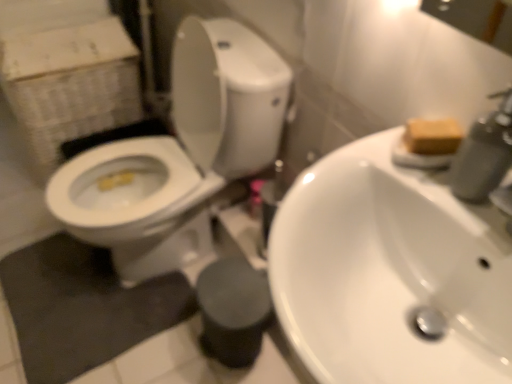
Image resolution: width=512 pixels, height=384 pixels. What do you see at coordinates (82, 307) in the screenshot?
I see `black rubber bath mat at lower left` at bounding box center [82, 307].

Locate an element on the screen. The height and width of the screenshot is (384, 512). brown matte soap at upper right is located at coordinates (433, 136).

Where is `matte gray soap dispenser at upper right`? Image resolution: width=512 pixels, height=384 pixels. matte gray soap dispenser at upper right is located at coordinates (484, 153).

What do you see at coordinates (484, 153) in the screenshot? The width and height of the screenshot is (512, 384). I see `matte gray soap dispenser at upper right` at bounding box center [484, 153].

The height and width of the screenshot is (384, 512). What do you see at coordinates (67, 71) in the screenshot?
I see `white cardboard box at left` at bounding box center [67, 71].

At what (x,y) coordinates should I click in order to perform the action: click on white glossy sink at center. Please return your answer as a coordinate pair (x, y). Looking at the image, I should click on (390, 272).

Is brown matte soap at upper right oriented away from white cardboard box at left?

No, brown matte soap at upper right is not facing the opposite direction of white cardboard box at left.

Is brown matte soap at upper right positioned far away from white cardboard box at left?

brown matte soap at upper right is far away from white cardboard box at left.

From the picture: From the image's perspective, is brown matte soap at upper right beneath white cardboard box at left?

Correct, brown matte soap at upper right appears lower than white cardboard box at left in the image.

I want to click on cardboard box located behind the brown matte soap at upper right, so click(x=67, y=71).

Consider the image. Who is shorter, white glossy toilet at left or matte gray soap dispenser at upper right?

matte gray soap dispenser at upper right is shorter.

Who is bigger, white glossy toilet at left or matte gray soap dispenser at upper right?

white glossy toilet at left is bigger.

Would you say white glossy toilet at left is a long distance from matte gray soap dispenser at upper right?

No, white glossy toilet at left is not far from matte gray soap dispenser at upper right.

From the image's perspective, which object appears higher, matte gray soap dispenser at upper right or black rubber bath mat at lower left?

matte gray soap dispenser at upper right, from the image's perspective.

Can black rubber bath mat at lower left be found inside matte gray soap dispenser at upper right?

No, black rubber bath mat at lower left is not a part of matte gray soap dispenser at upper right.

Which object is closer to the camera, matte gray soap dispenser at upper right or black rubber bath mat at lower left?

matte gray soap dispenser at upper right is in front.

Is matte gray soap dispenser at upper right thinner than black rubber bath mat at lower left?

Yes, matte gray soap dispenser at upper right is thinner than black rubber bath mat at lower left.

What's the angular difference between matte gray soap dispenser at upper right and white cardboard box at left's facing directions?

There is a 3.54-degree angle between the facing directions of matte gray soap dispenser at upper right and white cardboard box at left.

The image size is (512, 384). Find the location of `cardboard box that appears on the left of matte gray soap dispenser at upper right`. cardboard box that appears on the left of matte gray soap dispenser at upper right is located at coordinates (67, 71).

Between matte gray soap dispenser at upper right and white cardboard box at left, which one appears on the right side from the viewer's perspective?

From the viewer's perspective, matte gray soap dispenser at upper right appears more on the right side.

Is matte gray soap dispenser at upper right aimed at white cardboard box at left?

No, matte gray soap dispenser at upper right is not turned towards white cardboard box at left.

Can you confirm if black rubber bath mat at lower left is positioned to the left of white cardboard box at left?

Incorrect, black rubber bath mat at lower left is not on the left side of white cardboard box at left.

Is black rubber bath mat at lower left behind white cardboard box at left?

No, black rubber bath mat at lower left is in front of white cardboard box at left.

Which is correct: black rubber bath mat at lower left is inside white cardboard box at left, or outside of it?

black rubber bath mat at lower left is spatially situated outside white cardboard box at left.

From a real-world perspective, is black rubber bath mat at lower left above or below white cardboard box at left?

In terms of real-world spatial position, black rubber bath mat at lower left is below white cardboard box at left.

From a real-world perspective, does brown matte soap at upper right stand above black rubber bath mat at lower left?

Yes, from a real-world perspective, brown matte soap at upper right is above black rubber bath mat at lower left.

Considering the sizes of objects brown matte soap at upper right and black rubber bath mat at lower left in the image provided, who is shorter, brown matte soap at upper right or black rubber bath mat at lower left?

black rubber bath mat at lower left is shorter.

In the scene shown: From the image's perspective, who appears lower, brown matte soap at upper right or black rubber bath mat at lower left?

black rubber bath mat at lower left.

Which of these two, brown matte soap at upper right or black rubber bath mat at lower left, is thinner?

brown matte soap at upper right.

Is white cardboard box at left at the left side of matte gray soap dispenser at upper right?

Indeed, white cardboard box at left is positioned on the left side of matte gray soap dispenser at upper right.

Is white cardboard box at left thinner than matte gray soap dispenser at upper right?

In fact, white cardboard box at left might be wider than matte gray soap dispenser at upper right.

Where is `cardboard box that appears behind the matte gray soap dispenser at upper right`? The height and width of the screenshot is (384, 512). cardboard box that appears behind the matte gray soap dispenser at upper right is located at coordinates (67, 71).

In the image, there is a brown matte soap at upper right. Identify the location of cardboard box above it (from the image's perspective). This screenshot has height=384, width=512. (67, 71).

Image resolution: width=512 pixels, height=384 pixels. I want to click on plumbing fixture above the white glossy toilet at left (from a real-world perspective), so click(x=484, y=153).

Based on their spatial positions, is black rubber bath mat at lower left or white cardboard box at left further from white glossy sink at center?

white cardboard box at left is further to white glossy sink at center.

Which object lies further to the anchor point white cardboard box at left, black rubber bath mat at lower left or white glossy sink at center?

white glossy sink at center is positioned further to the anchor white cardboard box at left.

Considering their positions, is black rubber bath mat at lower left positioned further to white glossy toilet at left than white cardboard box at left?

white cardboard box at left is further to white glossy toilet at left.

When comparing their distances from white cardboard box at left, does white glossy toilet at left or black rubber bath mat at lower left seem closer?

white glossy toilet at left is positioned closer to the anchor white cardboard box at left.

Looking at this image, based on their spatial positions, is matte gray soap dispenser at upper right or white glossy toilet at left closer to white glossy sink at center?

Among the two, matte gray soap dispenser at upper right is located nearer to white glossy sink at center.

Which object lies nearer to the anchor point white glossy sink at center, black rubber bath mat at lower left or matte gray soap dispenser at upper right?

matte gray soap dispenser at upper right.

When comparing their distances from white glossy toilet at left, does white glossy sink at center or white cardboard box at left seem further?

white glossy sink at center.

In the scene shown: Estimate the real-world distances between objects in this image. Which object is further from matte gray soap dispenser at upper right, brown matte soap at upper right or white glossy sink at center?

white glossy sink at center lies further to matte gray soap dispenser at upper right than the other object.

This screenshot has height=384, width=512. What are the coordinates of `soap located between black rubber bath mat at lower left and matte gray soap dispenser at upper right in the left-right direction` in the screenshot? It's located at (433, 136).

Where is `toilet between white cardboard box at left and black rubber bath mat at lower left in the vertical direction`? toilet between white cardboard box at left and black rubber bath mat at lower left in the vertical direction is located at coordinates [180, 154].

The image size is (512, 384). Find the location of `soap between white glossy toilet at left and matte gray soap dispenser at upper right in the horizontal direction`. soap between white glossy toilet at left and matte gray soap dispenser at upper right in the horizontal direction is located at coordinates (433, 136).

Where is `bath mat situated between white cardboard box at left and matte gray soap dispenser at upper right from left to right`? The width and height of the screenshot is (512, 384). bath mat situated between white cardboard box at left and matte gray soap dispenser at upper right from left to right is located at coordinates (82, 307).